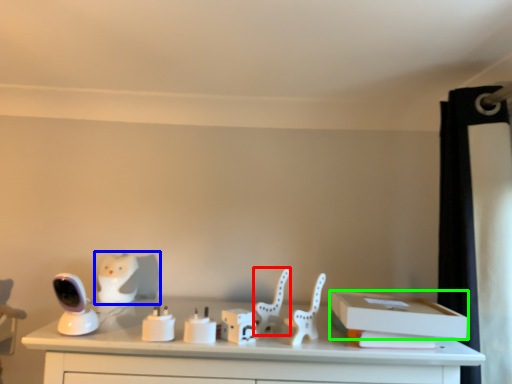
Question: Based on their relative distances, which object is nearer to animal (highlighted by a red box)? Choose from animal (highlighted by a blue box) and box (highlighted by a green box).

Choices:
 (A) animal
 (B) box

Answer: (B)